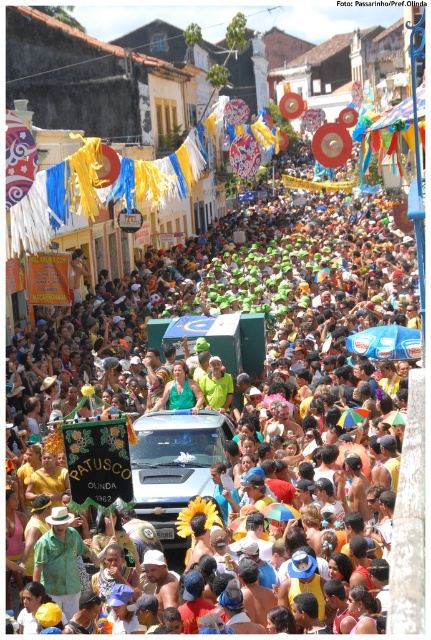
Looking at this image, you are a photographer trying to capture the vibrant crowd at the center of the festival. The multicolored fabric crowd at center is positioned at coordinates 0.492, 0.571. Can you confirm if this crowd is centrally located within the image frame?

The multicolored fabric crowd at center is located at point (246, 314), which is very close to the center coordinates of an image frame typically being around (215, 320). Therefore, the crowd is indeed centrally located within the image frame.

You are a photographer trying to capture a photo of the green matte shirt at center without the multicolored fabric crowd at center blocking the view. Is it possible to do so given their sizes?

The multicolored fabric crowd at center is larger in size than the green matte shirt at center, so it might block the view. Adjust your angle or position to ensure the green matte shirt at center is visible beyond or around the crowd.